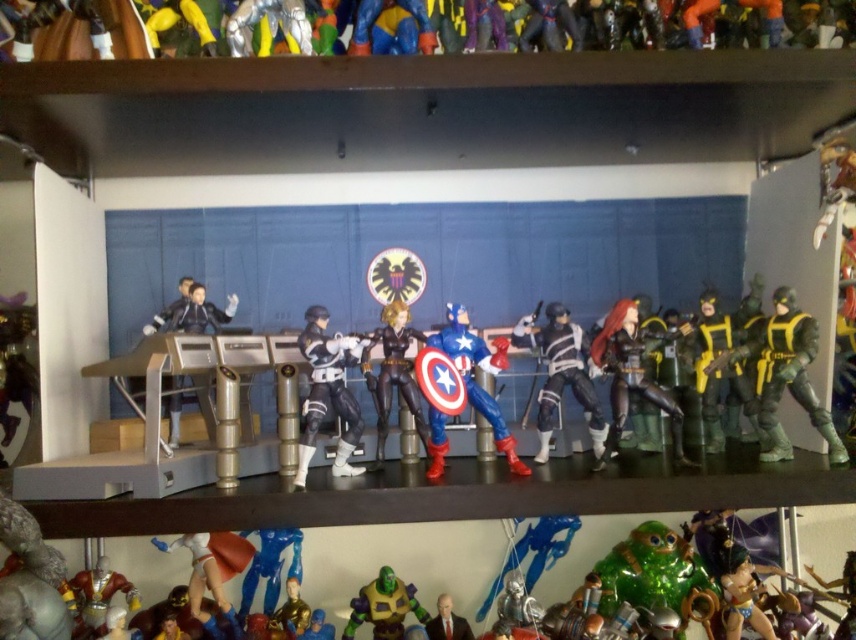
Question: Is matte black figure at center further to camera compared to shiny plastic captain america figure at center?

Choices:
 (A) yes
 (B) no

Answer: (A)

Question: Is yellow-green plastic figure at right thinner than shiny black figure at center?

Choices:
 (A) no
 (B) yes

Answer: (A)

Question: Which of these objects is positioned farthest from the blue plastic figure at lower center?

Choices:
 (A) green rubber alien at lower center
 (B) matte black figure at center
 (C) green matte figure at lower center
 (D) smooth plastic superhero at lower center

Answer: (B)

Question: Which object is farther from the camera taking this photo?

Choices:
 (A) matte black figure at left
 (B) shiny silver helmet at lower left

Answer: (A)

Question: Which point is farther to the camera?

Choices:
 (A) matte black figure at center
 (B) yellow-green plastic figure at right
 (C) black matte figure at center

Answer: (A)

Question: Where is green metallic turtle at lower center located in relation to black matte figure at center in the image?

Choices:
 (A) left
 (B) right

Answer: (B)